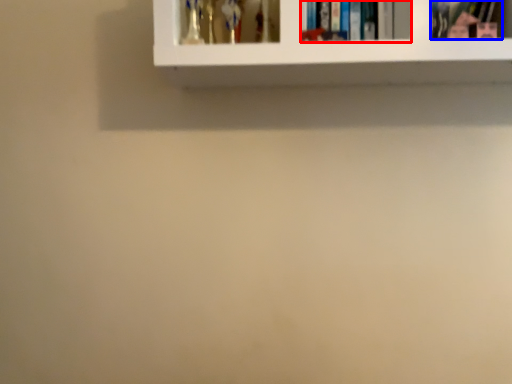
Question: Which point is closer to the camera, book (highlighted by a red box) or book (highlighted by a blue box)?

Choices:
 (A) book
 (B) book

Answer: (B)